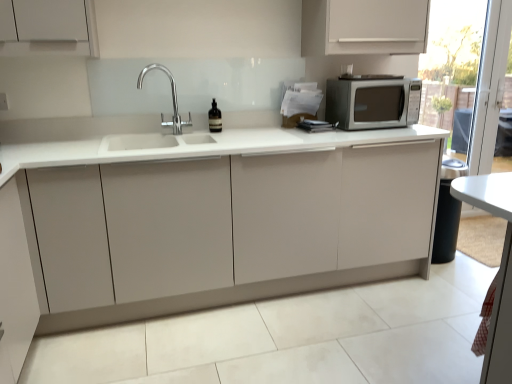
At what (x,y) coordinates should I click in order to perform the action: click on free space in front of chrome/metallic faucet at center. Please return your answer as a coordinate pair (x, y). This screenshot has height=384, width=512. Looking at the image, I should click on click(x=178, y=137).